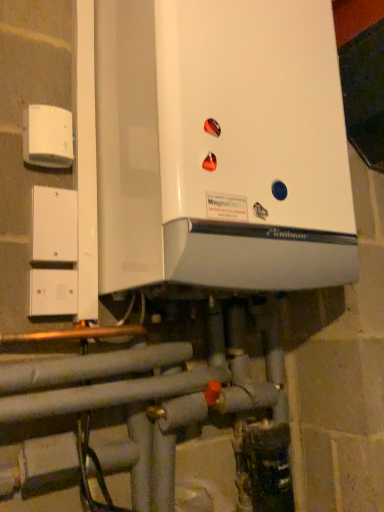
Question: Based on their positions, is white glossy boiler at center located to the left or right of white plastic electric outlet at upper left?

Choices:
 (A) right
 (B) left

Answer: (A)

Question: From the image's perspective, relative to white plastic electric outlet at upper left, is white glossy boiler at center above or below?

Choices:
 (A) below
 (B) above

Answer: (B)

Question: Which object is the farthest from the white plastic/light switch at left?

Choices:
 (A) white plastic electric outlet at upper left
 (B) white glossy boiler at center

Answer: (B)

Question: Which object is positioned closest to the white glossy boiler at center?

Choices:
 (A) white plastic/light switch at left
 (B) white plastic electric outlet at upper left

Answer: (B)